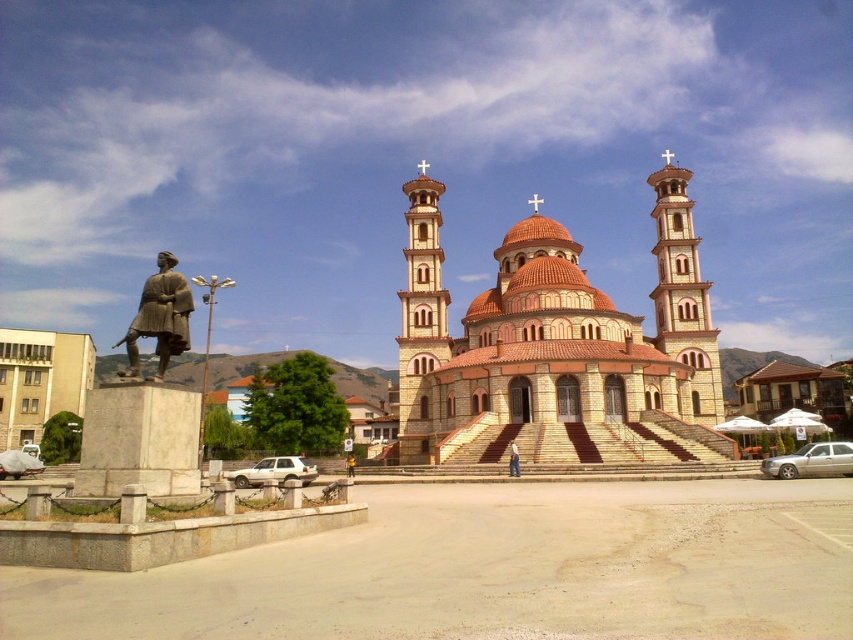
Question: Which object is the farthest from the bronze statue at left?

Choices:
 (A) light brown wooden statue at center
 (B) terracotta stone church at center
 (C) beige stone tower at center

Answer: (B)

Question: Estimate the real-world distances between objects in this image. Which object is farther from the light brown stone tower at center right?

Choices:
 (A) light brown wooden statue at center
 (B) terracotta stone church at center

Answer: (A)

Question: Which is nearer to the light brown wooden statue at center?

Choices:
 (A) bronze statue at left
 (B) light brown stone tower at center right

Answer: (B)

Question: Can you confirm if gold-bronze statue at left is positioned to the right of bronze statue at left?

Choices:
 (A) no
 (B) yes

Answer: (B)

Question: Does terracotta stone church at center appear on the left side of gold-bronze statue at left?

Choices:
 (A) yes
 (B) no

Answer: (B)

Question: Does terracotta stone church at center appear under light brown wooden statue at center?

Choices:
 (A) no
 (B) yes

Answer: (A)